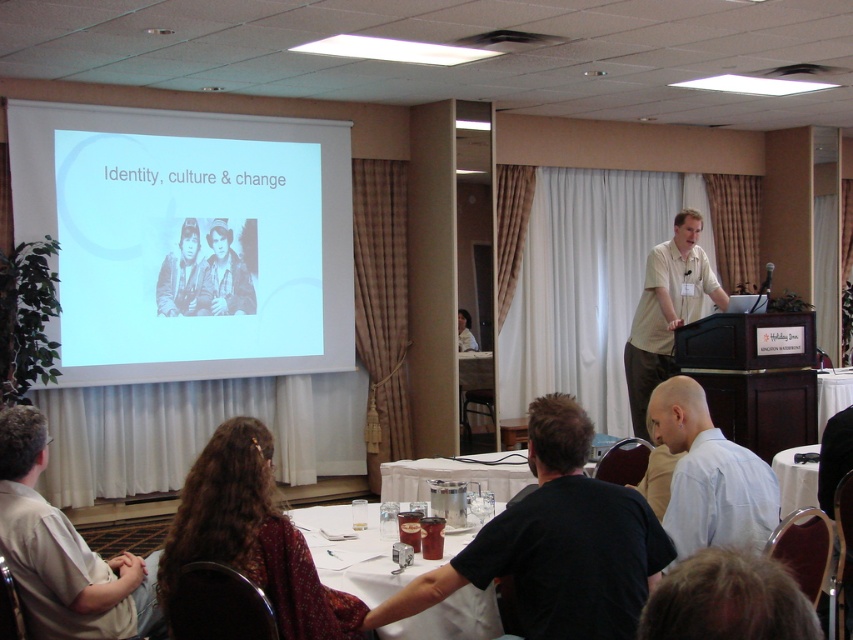
You are organizing a photo shoot in the conference room and need to place a large camera on the table. The camera requires a space wider than the grayscale photo of two people at center. Can the black matte shirt at lower center provide enough space for the camera?

The black matte shirt at lower center might be wider than the grayscale photo of two people at center, so it could potentially provide enough space for the camera if its width meets the requirement.

You are organizing a photo shoot and need to know the relative sizes of the objects in the scene. Based on the image, is the light beige shirt at right wider than the grayscale photo of two people at center?

The light beige shirt at right might be wider than grayscale photo of two people at center.

You are a photographer in the conference room. You need to take a photo of the grayscale photo of two people at center without including the light beige shirt at right in the frame. Is this possible given their positions?

The light beige shirt at right is below the grayscale photo of two people at center, so if you position yourself to capture the grayscale photo of two people at center from above or adjust your angle to exclude the area where the light beige shirt at right is located, it should be possible to take the photo without including it.